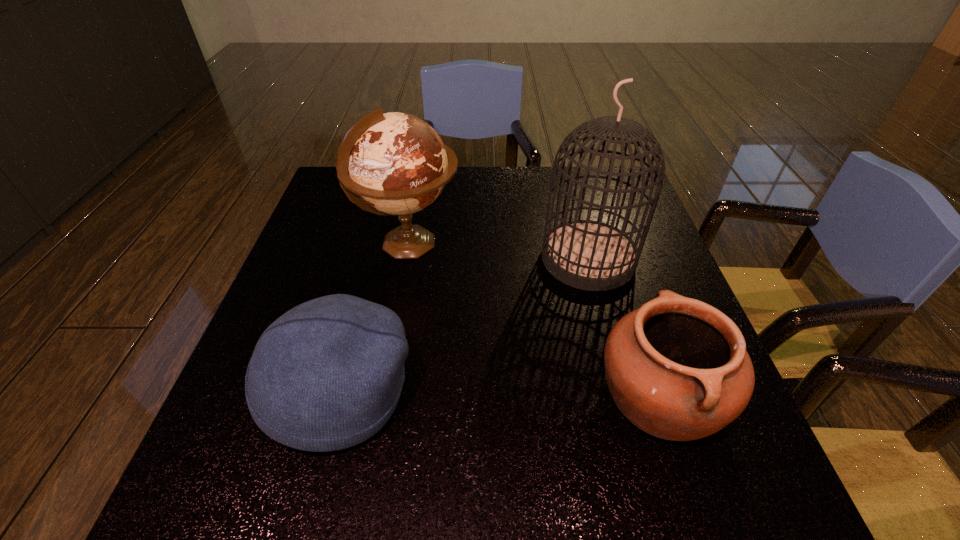
Find the location of a particular element. empty location between the third shortest object and the tallest object is located at coordinates (498, 252).

Locate an element on the screen. The height and width of the screenshot is (540, 960). vacant point located between the globe and the birdcage is located at coordinates (498, 252).

The height and width of the screenshot is (540, 960). In order to click on vacant area between the birdcage and the skullcap in this screenshot , I will do `click(465, 325)`.

What are the coordinates of `free space between the pottery and the third shortest object` in the screenshot? It's located at (535, 320).

Identify the location of free space between the globe and the pottery. Image resolution: width=960 pixels, height=540 pixels. (535, 320).

Find the location of a particular element. blank region between the pottery and the second tallest object is located at coordinates pyautogui.click(x=535, y=320).

Identify the location of free area in between the pottery and the globe. The width and height of the screenshot is (960, 540). (535, 320).

Where is `object that is the third nearest to the birdcage`? This screenshot has height=540, width=960. object that is the third nearest to the birdcage is located at coordinates (327, 375).

The image size is (960, 540). What are the coordinates of `object that is the second closest to the skullcap` in the screenshot? It's located at (589, 255).

Where is `vacant space that satisfies the following two spatial constraints: 1. on the back side of the birdcage; 2. on the left side of the skullcap`? The height and width of the screenshot is (540, 960). vacant space that satisfies the following two spatial constraints: 1. on the back side of the birdcage; 2. on the left side of the skullcap is located at coordinates (375, 259).